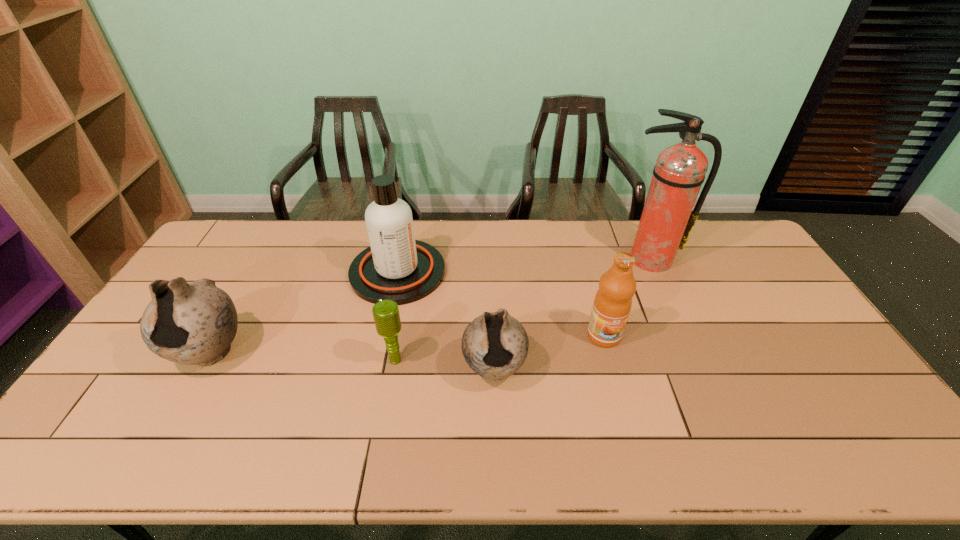
The width and height of the screenshot is (960, 540). Identify the location of free space located from the spout of the shorter pottery. (495, 417).

Image resolution: width=960 pixels, height=540 pixels. I want to click on vacant area situated 0.070m on the label side of the second object from right to left, so click(x=612, y=369).

Identify the location of vacant space situated 0.120m on the back of the cleansing agent. This screenshot has width=960, height=540. (408, 224).

You are a GUI agent. You are given a task and a screenshot of the screen. Output one action in this format:
    pyautogui.click(x=<x>, y=<y>)
    Task: Click on the vacant space located at the nozzle of the rightmost object
    
    Given the screenshot: What is the action you would take?
    tap(687, 348)

Where is `vacant region located on the right of the microphone`? The height and width of the screenshot is (540, 960). vacant region located on the right of the microphone is located at coordinates (498, 360).

Image resolution: width=960 pixels, height=540 pixels. I want to click on cleansing agent that is at the far edge, so click(x=397, y=267).

Locate an element on the screen. This screenshot has height=540, width=960. fire extinguisher that is at the far edge is located at coordinates (667, 220).

Locate an element on the screen. The height and width of the screenshot is (540, 960). object that is at the near edge is located at coordinates (495, 345).

Locate an element on the screen. This screenshot has height=540, width=960. object at the left edge is located at coordinates (192, 323).

This screenshot has height=540, width=960. In order to click on vacant space at the far edge of the desktop in this screenshot , I will do pyautogui.click(x=287, y=234).